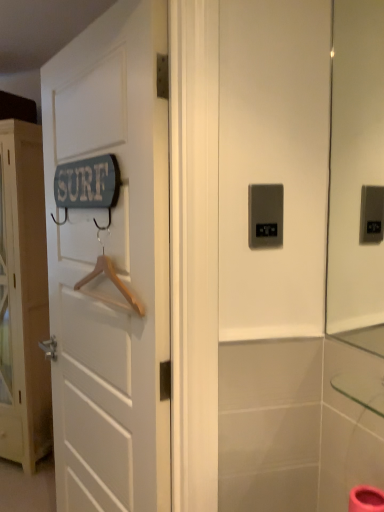
Image resolution: width=384 pixels, height=512 pixels. Describe the element at coordinates (112, 281) in the screenshot. I see `wooden hanger at left` at that location.

What is the approximate width of satin silver panel at center?

The width of satin silver panel at center is 0.58 inches.

Locate an element on the screen. The width and height of the screenshot is (384, 512). white wooden door at left, the first door positioned from the right is located at coordinates (113, 268).

What do you see at coordinates (23, 298) in the screenshot? The image size is (384, 512). I see `white wooden door at left, positioned as the first door in left-to-right order` at bounding box center [23, 298].

Measure the distance between white wooden door at left, positioned as the 2th door in right-to-left order, and camera.

A distance of 2.23 meters exists between white wooden door at left, positioned as the 2th door in right-to-left order, and camera.

What are the coordinates of `wooden hanger at left` in the screenshot? It's located at (112, 281).

Is white wooden door at left, marked as the 1th door in a back-to-front arrangement, inside wooden hanger at left?

No, white wooden door at left, marked as the 1th door in a back-to-front arrangement, is not inside wooden hanger at left.

Is wooden hanger at left to the left or to the right of white wooden door at left, positioned as the first door in left-to-right order, in the image?

Clearly, wooden hanger at left is on the right of white wooden door at left, positioned as the first door in left-to-right order, in the image.

Who is shorter, wooden hanger at left or white wooden door at left, marked as the 1th door in a back-to-front arrangement?

With less height is wooden hanger at left.

Are wooden hanger at left and white wooden door at left, positioned as the 2th door in right-to-left order, making contact?

No, wooden hanger at left is not beside white wooden door at left, positioned as the 2th door in right-to-left order.

Considering the relative sizes of white wooden door at left, the 2th door positioned from the left, and white wooden door at left, positioned as the 2th door in right-to-left order, in the image provided, is white wooden door at left, the 2th door positioned from the left, bigger than white wooden door at left, positioned as the 2th door in right-to-left order,?

Incorrect, white wooden door at left, the 2th door positioned from the left, is not larger than white wooden door at left, positioned as the 2th door in right-to-left order.

From a real-world perspective, is white wooden door at left, the 2th door positioned from the left, positioned above or below white wooden door at left, positioned as the first door in left-to-right order?

white wooden door at left, the 2th door positioned from the left, is above white wooden door at left, positioned as the first door in left-to-right order.

Are white wooden door at left, positioned as the 2th door in back-to-front order, and white wooden door at left, positioned as the 2th door in right-to-left order, located far from each other?

white wooden door at left, positioned as the 2th door in back-to-front order, is positioned a significant distance from white wooden door at left, positioned as the 2th door in right-to-left order.

Can you confirm if white wooden door at left, acting as the first door starting from the front, is taller than white wooden door at left, the 2th door from the front?

Incorrect, the height of white wooden door at left, acting as the first door starting from the front, is not larger of that of white wooden door at left, the 2th door from the front.

Which of these two, white wooden door at left, positioned as the 2th door in back-to-front order, or wooden hanger at left, is wider?

With larger width is white wooden door at left, positioned as the 2th door in back-to-front order.

Between white wooden door at left, the first door positioned from the right, and wooden hanger at left, which one appears on the left side from the viewer's perspective?

From the viewer's perspective, white wooden door at left, the first door positioned from the right, appears more on the left side.

Does point (102, 133) lie behind point (129, 297)?

That is True.

Are white wooden door at left, marked as the 1th door in a back-to-front arrangement, and satin silver panel at center located far from each other?

Yes, white wooden door at left, marked as the 1th door in a back-to-front arrangement, is far from satin silver panel at center.

Which object is positioned more to the right, white wooden door at left, the 2th door from the front, or satin silver panel at center?

Positioned to the right is satin silver panel at center.

Can you tell me how much white wooden door at left, the 2th door from the front, and satin silver panel at center differ in facing direction?

36.5 degrees separate the facing orientations of white wooden door at left, the 2th door from the front, and satin silver panel at center.

Based on the photo, is white wooden door at left, positioned as the first door in left-to-right order, oriented towards satin silver panel at center?

No, white wooden door at left, positioned as the first door in left-to-right order, is not turned towards satin silver panel at center.

Is satin silver panel at center next to white wooden door at left, the 2th door positioned from the left, and touching it?

No.

From the picture: Is satin silver panel at center smaller than white wooden door at left, the 2th door positioned from the left?

Yes, satin silver panel at center is smaller than white wooden door at left, the 2th door positioned from the left.

Could you tell me if satin silver panel at center is turned towards white wooden door at left, the 2th door positioned from the left?

No, satin silver panel at center is not turned towards white wooden door at left, the 2th door positioned from the left.

Does point (10, 180) appear closer or farther from the camera than point (109, 269)?

Point (10, 180) appears to be farther away from the viewer than point (109, 269).

Would you consider white wooden door at left, marked as the 1th door in a back-to-front arrangement, to be distant from wooden hanger at left?

Yes, white wooden door at left, marked as the 1th door in a back-to-front arrangement, and wooden hanger at left are located far from each other.

In the scene shown: How many degrees apart are the facing directions of white wooden door at left, positioned as the 2th door in right-to-left order, and wooden hanger at left?

30 degrees.

Where is `hanger in front of the white wooden door at left, marked as the 1th door in a back-to-front arrangement`? Image resolution: width=384 pixels, height=512 pixels. hanger in front of the white wooden door at left, marked as the 1th door in a back-to-front arrangement is located at coordinates (112, 281).

You are a GUI agent. You are given a task and a screenshot of the screen. Output one action in this format:
    pyautogui.click(x=<x>, y=<y>)
    Task: Click on the light switch located behind the white wooden door at left, positioned as the 2th door in back-to-front order
    
    Given the screenshot: What is the action you would take?
    pyautogui.click(x=265, y=215)

Is white wooden door at left, positioned as the 2th door in back-to-front order, positioned beyond the bounds of satin silver panel at center?

white wooden door at left, positioned as the 2th door in back-to-front order, is positioned outside satin silver panel at center.

How different are the orientations of white wooden door at left, the first door positioned from the right, and satin silver panel at center in degrees?

The angle between the facing direction of white wooden door at left, the first door positioned from the right, and the facing direction of satin silver panel at center is 66.5 degrees.

From the image's perspective, which is above, white wooden door at left, the first door positioned from the right, or satin silver panel at center?

satin silver panel at center is shown above in the image.

This screenshot has width=384, height=512. There is a wooden hanger at left. Identify the location of the 2nd door below it (from the image's perspective). (23, 298).

You are a GUI agent. You are given a task and a screenshot of the screen. Output one action in this format:
    pyautogui.click(x=<x>, y=<y>)
    Task: Click on the door that is on the left side of white wooden door at left, positioned as the 2th door in back-to-front order
    The image size is (384, 512).
    Given the screenshot: What is the action you would take?
    pyautogui.click(x=23, y=298)

Looking at the image, which one is located further to white wooden door at left, the 2th door from the front, wooden hanger at left or satin silver panel at center?

Based on the image, satin silver panel at center appears to be further to white wooden door at left, the 2th door from the front.

From the image, which object appears to be nearer to satin silver panel at center, wooden hanger at left or white wooden door at left, the 2th door from the front?

Based on the image, wooden hanger at left appears to be nearer to satin silver panel at center.

From the image, which object appears to be nearer to satin silver panel at center, white wooden door at left, the first door positioned from the right, or white wooden door at left, positioned as the 2th door in right-to-left order?

white wooden door at left, the first door positioned from the right, is closer to satin silver panel at center.

Estimate the real-world distances between objects in this image. Which object is further from white wooden door at left, positioned as the first door in left-to-right order, white wooden door at left, the first door positioned from the right, or satin silver panel at center?

satin silver panel at center.

Based on their spatial positions, is white wooden door at left, positioned as the 2th door in right-to-left order, or satin silver panel at center further from wooden hanger at left?

white wooden door at left, positioned as the 2th door in right-to-left order, is further to wooden hanger at left.

Consider the image. Which object lies further to the anchor point white wooden door at left, acting as the first door starting from the front, wooden hanger at left or white wooden door at left, positioned as the first door in left-to-right order?

white wooden door at left, positioned as the first door in left-to-right order, is further to white wooden door at left, acting as the first door starting from the front.

Considering their positions, is wooden hanger at left positioned closer to white wooden door at left, marked as the 1th door in a back-to-front arrangement, than white wooden door at left, positioned as the 2th door in back-to-front order?

white wooden door at left, positioned as the 2th door in back-to-front order.

When comparing their distances from wooden hanger at left, does satin silver panel at center or white wooden door at left, the 2th door positioned from the left, seem further?

satin silver panel at center lies further to wooden hanger at left than the other object.

I want to click on hanger located between white wooden door at left, positioned as the 2th door in back-to-front order, and white wooden door at left, positioned as the 2th door in right-to-left order, in the depth direction, so click(x=112, y=281).

Locate an element on the screen. This screenshot has height=512, width=384. hanger between white wooden door at left, positioned as the first door in left-to-right order, and satin silver panel at center from left to right is located at coordinates (112, 281).

What are the coordinates of `hanger between white wooden door at left, positioned as the 2th door in back-to-front order, and satin silver panel at center, in the horizontal direction` in the screenshot? It's located at [112, 281].

Identify the location of light switch between white wooden door at left, the 2th door positioned from the left, and white wooden door at left, positioned as the first door in left-to-right order, in the front-back direction. The width and height of the screenshot is (384, 512). (265, 215).